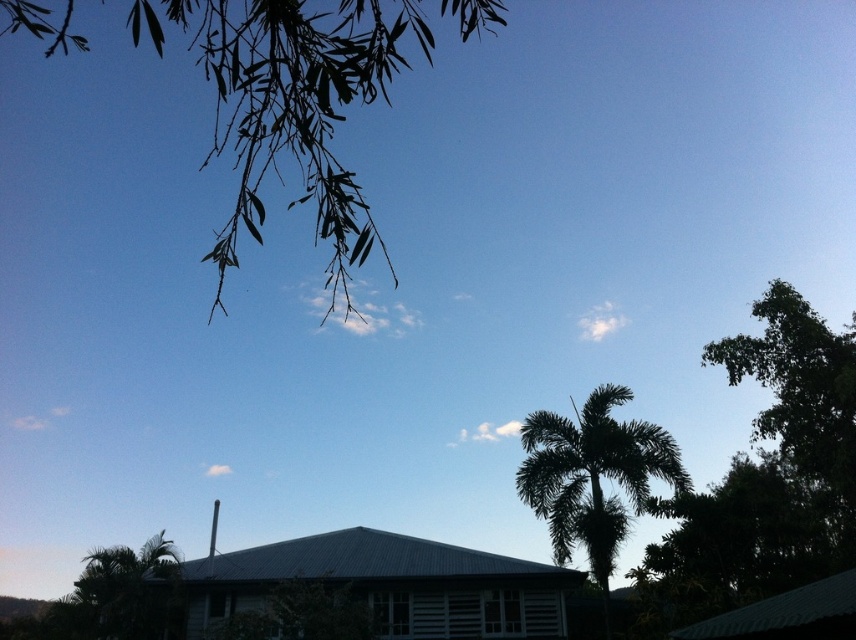
Consider the image. Can you confirm if green leafy branches at upper left is positioned to the right of green leafy palm tree at lower left?

No, green leafy branches at upper left is not to the right of green leafy palm tree at lower left.

Does point (351, 246) lie in front of point (149, 627)?

Yes, point (351, 246) is in front of point (149, 627).

In order to click on green leafy branches at upper left in this screenshot , I will do `click(290, 104)`.

Between dark green leafy palm tree at center and green leafy palm tree at lower left, which one appears on the left side from the viewer's perspective?

green leafy palm tree at lower left is more to the left.

Can you confirm if dark green leafy palm tree at center is positioned below green leafy palm tree at lower left?

Yes, dark green leafy palm tree at center is below green leafy palm tree at lower left.

Which is in front, point (560, 492) or point (116, 618)?

Point (116, 618)

The image size is (856, 640). I want to click on dark green leafy palm tree at center, so click(592, 474).

Who is shorter, green leafy branches at upper left or dark green leafy palm tree at center?

With less height is dark green leafy palm tree at center.

Is point (376, 17) less distant than point (635, 500)?

Yes, point (376, 17) is closer to viewer.

Between point (459, 10) and point (553, 467), which one is positioned behind?

Point (553, 467)

Where is `green leafy branches at upper left`? green leafy branches at upper left is located at coordinates pos(290,104).